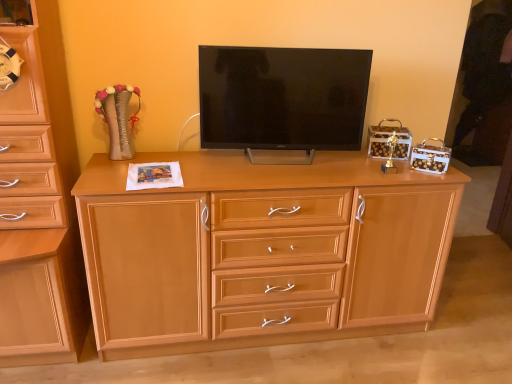
Question: Visually, is matte wood chest of drawers at left, the second chest of drawers viewed from the right, positioned to the left or to the right of matte black tv at center?

Choices:
 (A) left
 (B) right

Answer: (A)

Question: From a real-world perspective, is matte wood chest of drawers at left, the 1th chest of drawers viewed from the left, above or below matte black tv at center?

Choices:
 (A) below
 (B) above

Answer: (A)

Question: Estimate the real-world distances between objects in this image. Which object is farther from the matte black tv at center?

Choices:
 (A) matte wood chest of drawers at left, the 1th chest of drawers viewed from the left
 (B) light wood chest of drawers at center, which is the second chest of drawers from left to right

Answer: (A)

Question: Estimate the real-world distances between objects in this image. Which object is farther from the matte black tv at center?

Choices:
 (A) matte wood chest of drawers at left, the 1th chest of drawers viewed from the left
 (B) light wood chest of drawers at center, which appears as the 1th chest of drawers when viewed from the right

Answer: (A)